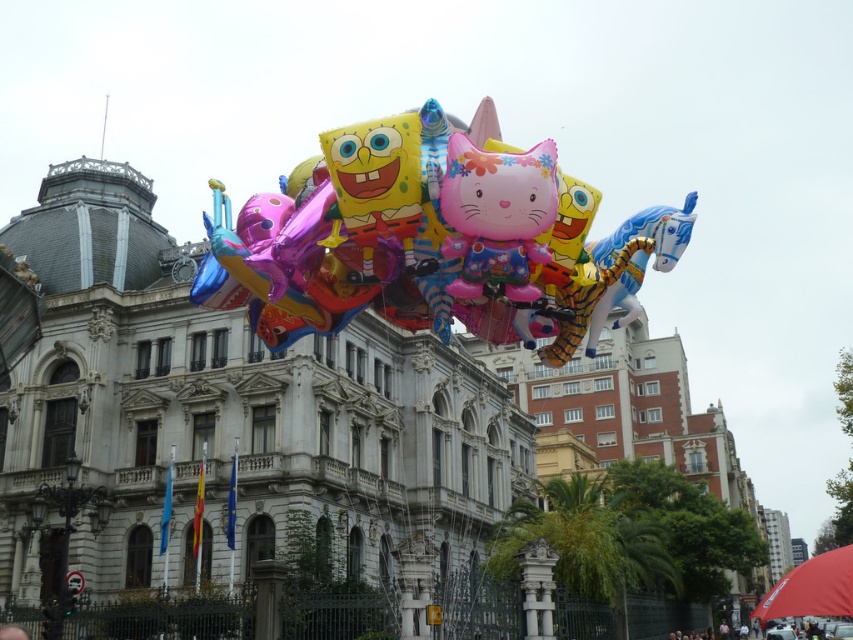
Question: Is glossy metallic balloons at center to the right of dark blue fabric at center from the viewer's perspective?

Choices:
 (A) yes
 (B) no

Answer: (B)

Question: Which is nearer to the glossy metallic balloons at center?

Choices:
 (A) dark blue fabric at center
 (B) glossy plastic cat at center

Answer: (B)

Question: Which of the following is the closest to the observer?

Choices:
 (A) dark blue fabric at center
 (B) glossy metallic balloons at center

Answer: (B)

Question: Does glossy metallic balloons at center appear under dark blue fabric at center?

Choices:
 (A) no
 (B) yes

Answer: (A)

Question: Which of the following is the farthest from the observer?

Choices:
 (A) (722, 621)
 (B) (490, 225)
 (C) (206, 220)

Answer: (A)

Question: Is glossy metallic balloons at center behind dark blue fabric at center?

Choices:
 (A) yes
 (B) no

Answer: (B)